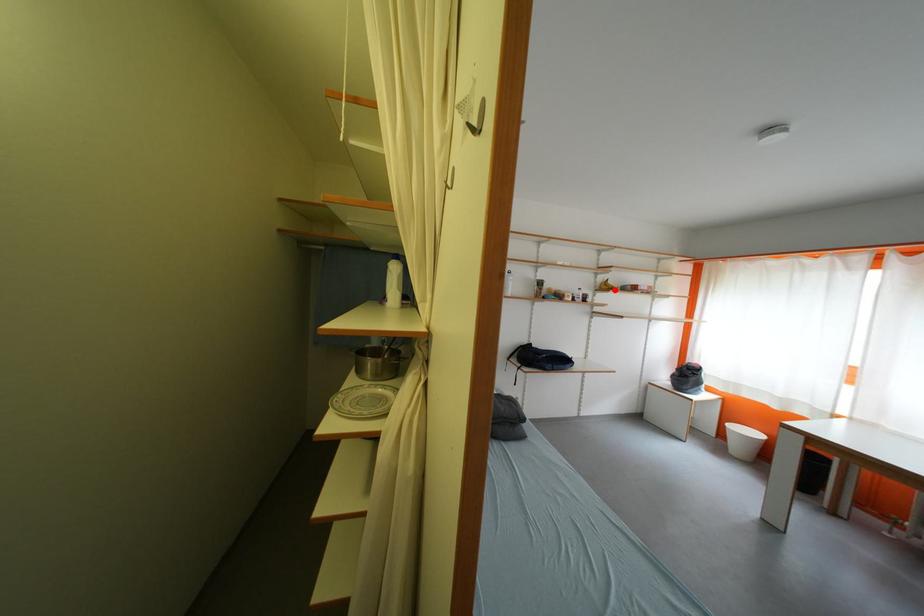
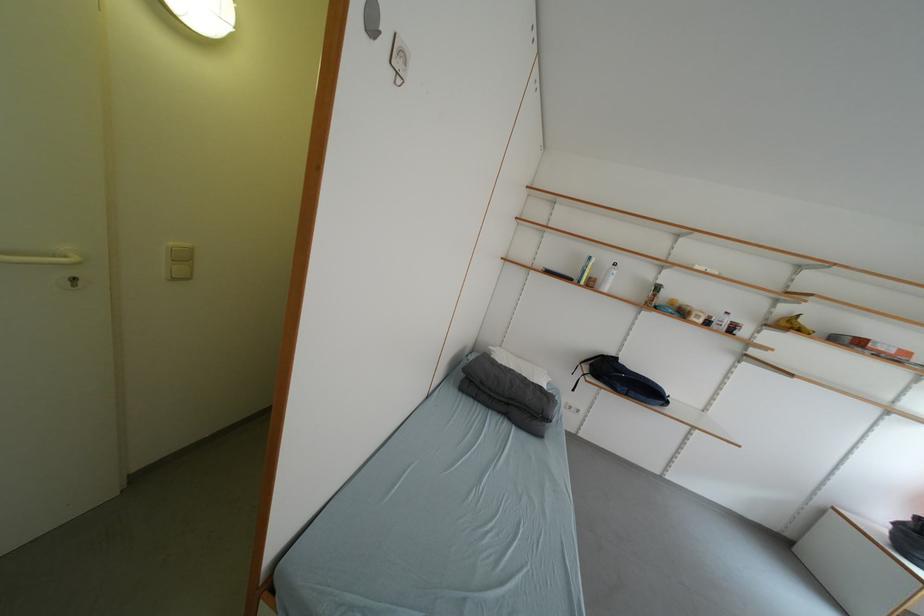
Locate, in the second image, the point that corresponds to the highlighted location in the first image.

(797, 328)